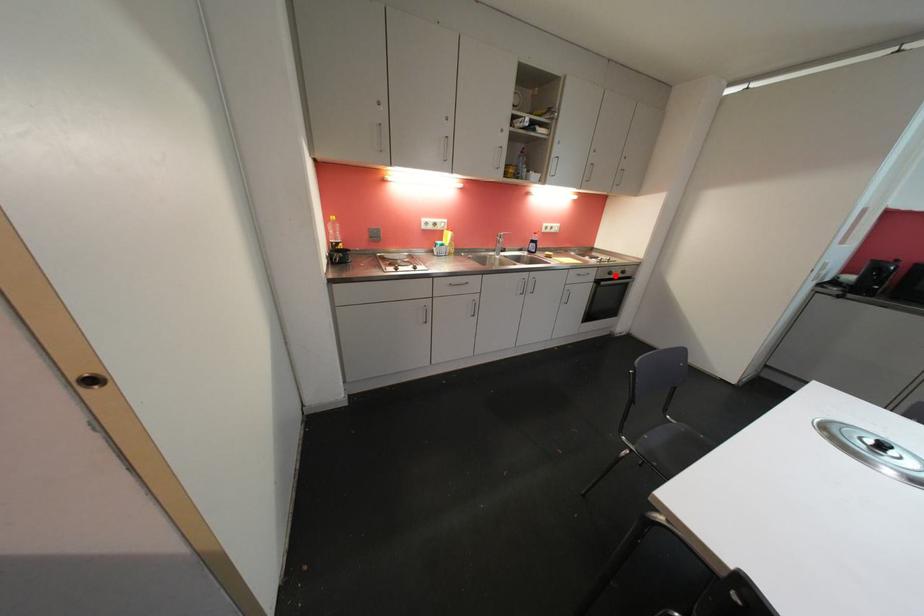
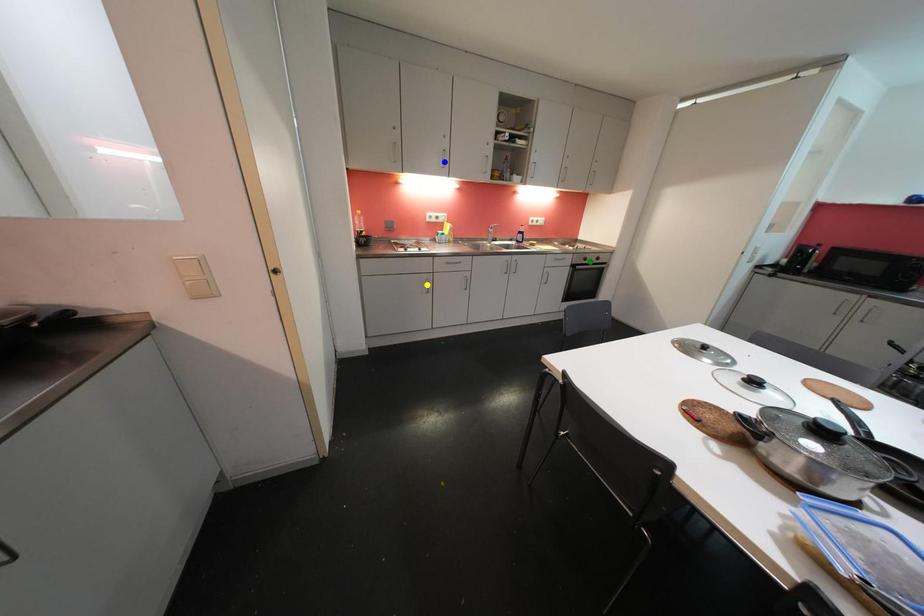
Question: I am providing you with two images of the same scene from different viewpoints. A red point is marked on the first image. You are given multiple points on the second image. Which spot in image 2 lines up with the point in image 1?

Choices:
 (A) yellow point
 (B) green point
 (C) blue point

Answer: (B)